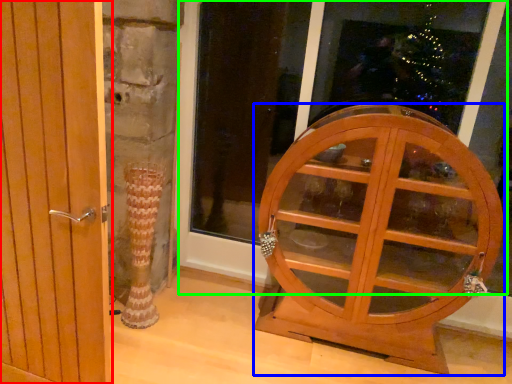
Question: Based on their relative distances, which object is nearer to door (highlighted by a red box)? Choose from furniture (highlighted by a blue box) and window frame (highlighted by a green box).

Choices:
 (A) furniture
 (B) window frame

Answer: (A)